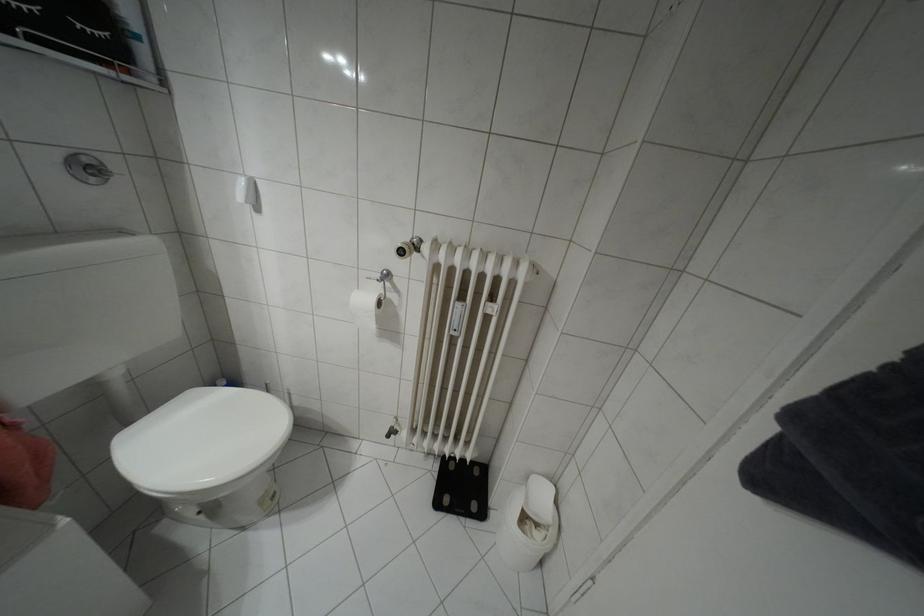
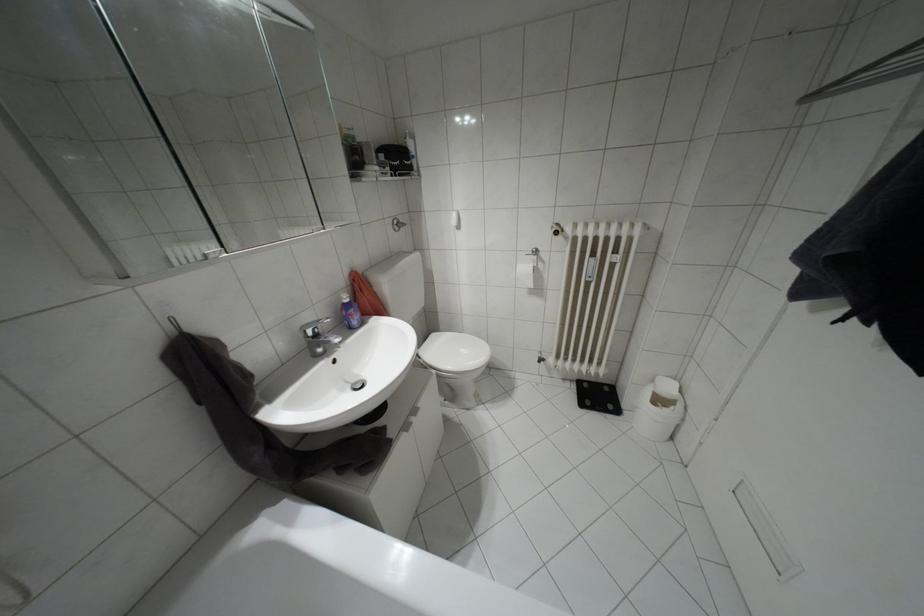
Question: Based on the continuous images, in which direction is the camera rotating? Reply with the corresponding letter.

Choices:
 (A) Left
 (B) Right
 (C) Up
 (D) Down

Answer: (A)